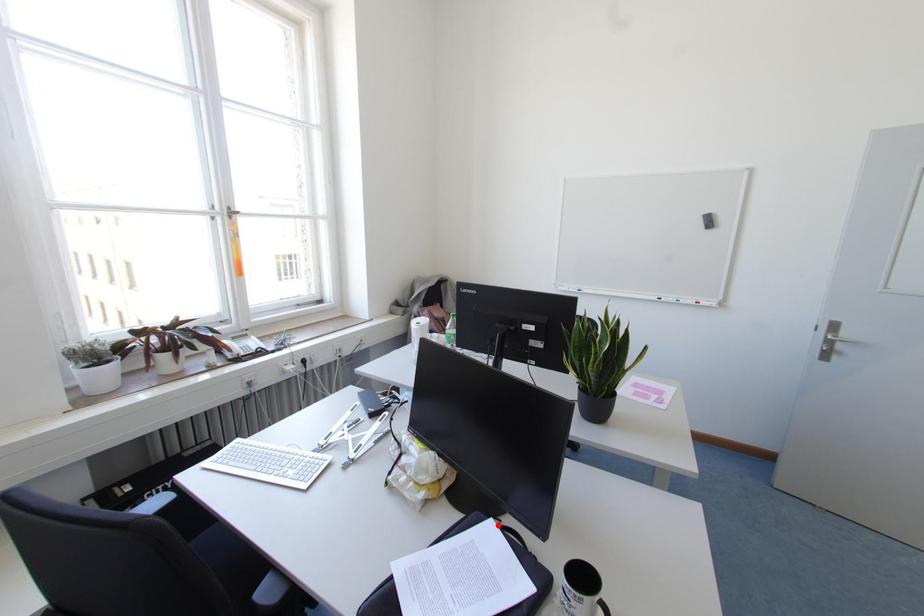
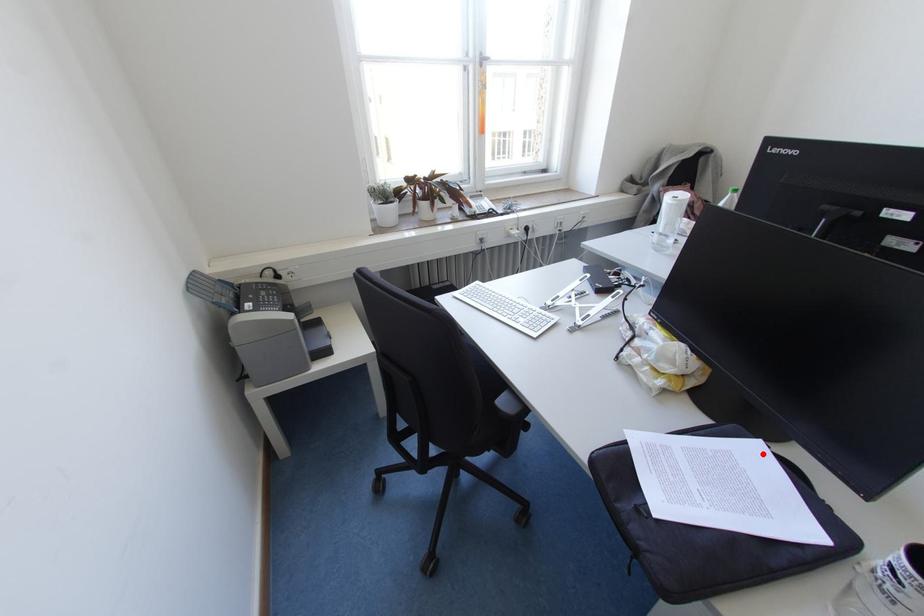
I am providing you with two images of the same scene from different viewpoints. A red point is marked on the first image and another point is marked on the second image. Is the marked point in image1 the same physical position as the marked point in image2?

Yes